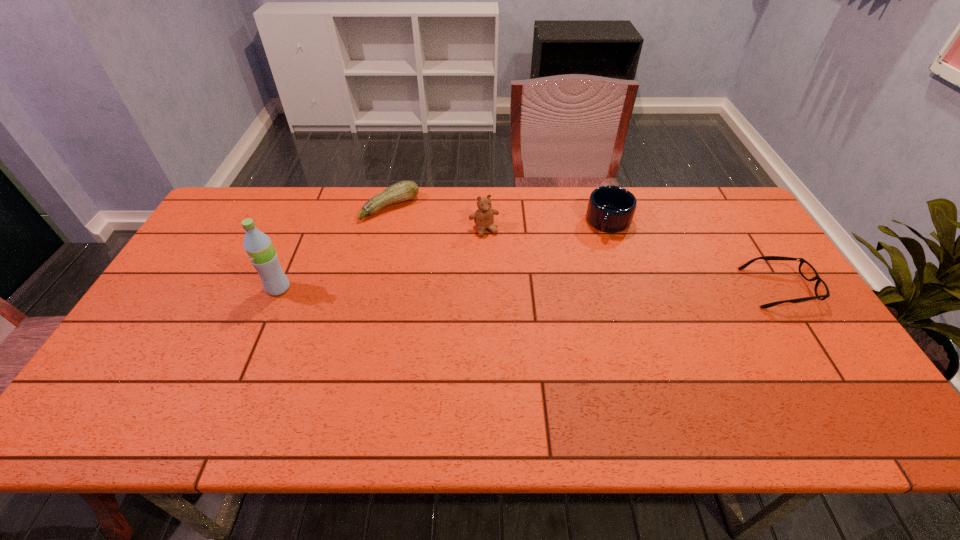
Find the location of a particular element. The height and width of the screenshot is (540, 960). vacant region that satisfies the following two spatial constraints: 1. on the front side of the third object from left to right; 2. on the right side of the fourth object from right to left is located at coordinates (385, 230).

Find the location of a particular element. The image size is (960, 540). vacant space that satisfies the following two spatial constraints: 1. on the front side of the spectacles; 2. on the front-facing side of the teddy bear is located at coordinates (485, 288).

I want to click on free location that satisfies the following two spatial constraints: 1. on the front side of the tallest object; 2. on the front-facing side of the rightmost object, so [278, 288].